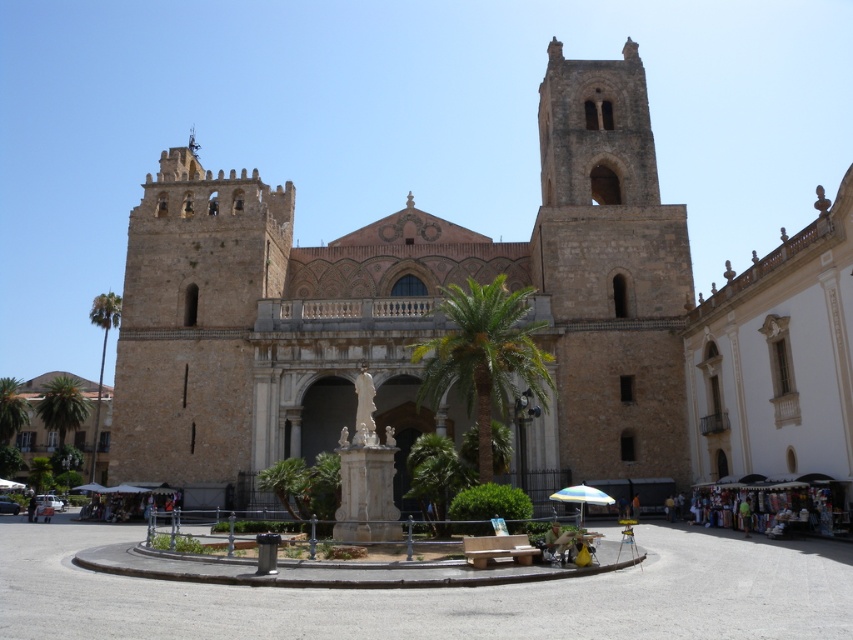
Question: Is brown stone tower at upper right below green leafy palm tree at left?

Choices:
 (A) no
 (B) yes

Answer: (A)

Question: Which point is farther to the camera?

Choices:
 (A) (427, 362)
 (B) (108, 292)
 (C) (378, 241)

Answer: (B)

Question: Is brown stone church at center above green leafy palm tree at left?

Choices:
 (A) no
 (B) yes

Answer: (B)

Question: Which point is farther to the camera?

Choices:
 (A) (199, 380)
 (B) (161, 266)
 (C) (503, 288)
 (D) (61, 445)

Answer: (D)

Question: Does brown stone tower at upper right have a smaller size compared to brown stone tower at left?

Choices:
 (A) yes
 (B) no

Answer: (A)

Question: Which point is closer to the camera taking this photo?

Choices:
 (A) (566, 378)
 (B) (648, 390)
 (C) (136, 232)
 (D) (457, 372)

Answer: (D)